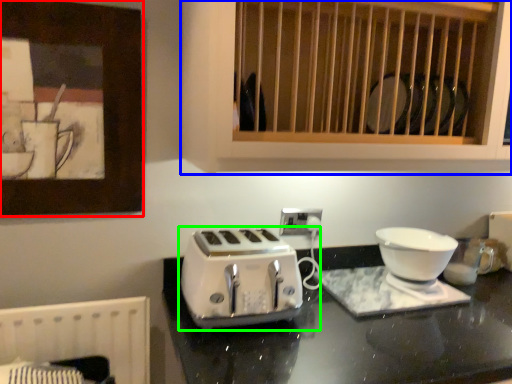
Question: Which object is the farthest from picture frame (highlighted by a red box)? Choose among these: cabinetry (highlighted by a blue box) or toaster (highlighted by a green box).

Choices:
 (A) cabinetry
 (B) toaster

Answer: (B)